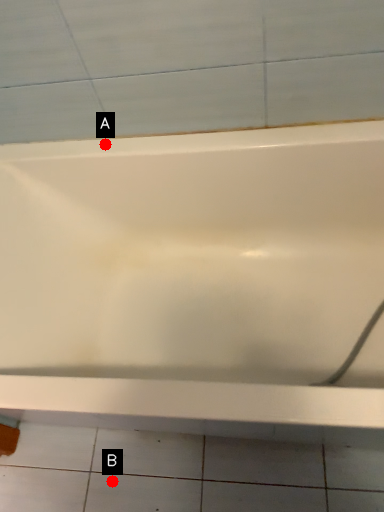
Question: Two points are circled on the image, labeled by A and B beside each circle. Which point appears farthest from the camera in this image?

Choices:
 (A) A is further
 (B) B is further

Answer: (B)